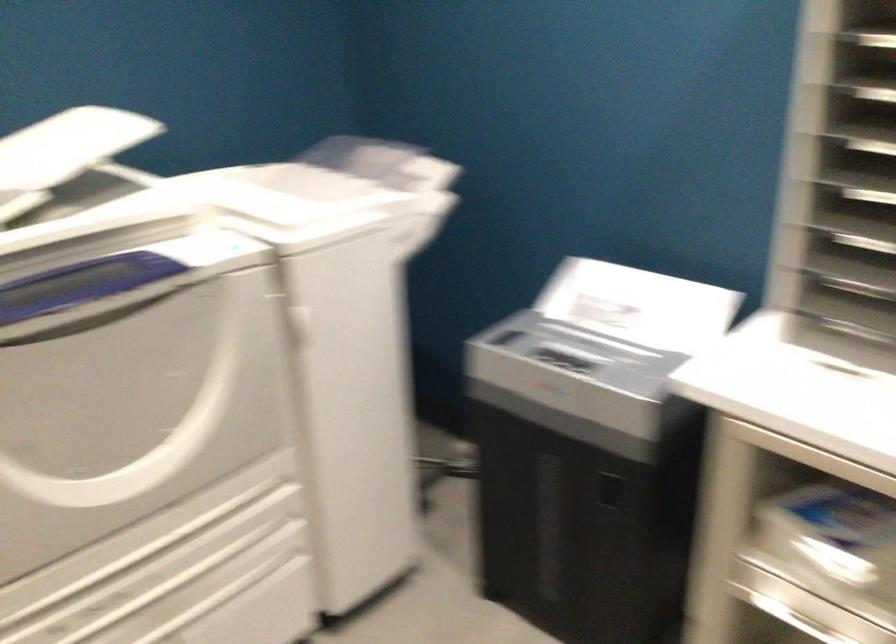
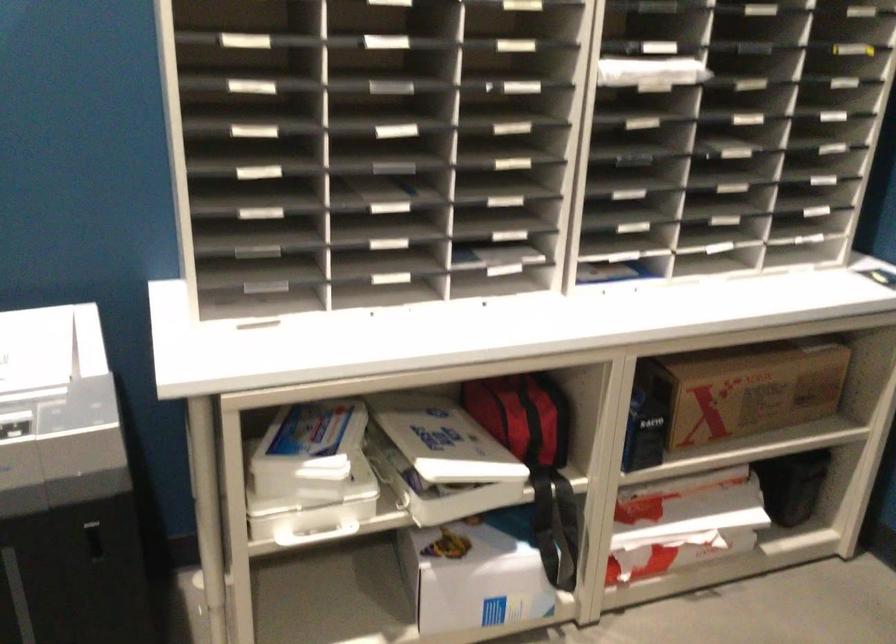
Question: The camera is either moving clockwise (left) or counter-clockwise (right) around the object. The first image is from the beginning of the video and the second image is from the end. Is the camera moving left or right when shooting the video?

Choices:
 (A) Left
 (B) Right

Answer: (A)